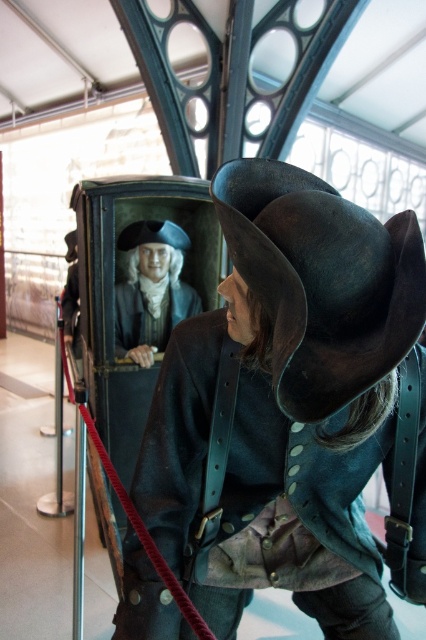
Can you confirm if dark brown leather hat at center is bigger than matte black hat at center?

Yes, dark brown leather hat at center is bigger than matte black hat at center.

Does point (259, 248) come closer to viewer compared to point (134, 227)?

Yes, it is.

Who is more forward, [411,228] or [178,227]?

Point [411,228]

I want to click on dark brown leather hat at center, so click(x=322, y=282).

Which is in front, point (161, 252) or point (166, 236)?

Positioned in front is point (161, 252).

Is point (152, 337) behind point (163, 236)?

Yes, point (152, 337) is farther from viewer.

At what (x,y) coordinates should I click in order to perform the action: click on matte black bust at upper center. Please return your answer as a coordinate pair (x, y). Image resolution: width=426 pixels, height=640 pixels. Looking at the image, I should click on (150, 289).

Which of these two, dark brown leather hat at center or matte black bust at upper center, stands shorter?

dark brown leather hat at center is shorter.

Between point (278, 188) and point (146, 333), which one is positioned in front?

Positioned in front is point (278, 188).

Locate an element on the screen. The height and width of the screenshot is (640, 426). dark brown leather hat at center is located at coordinates (322, 282).